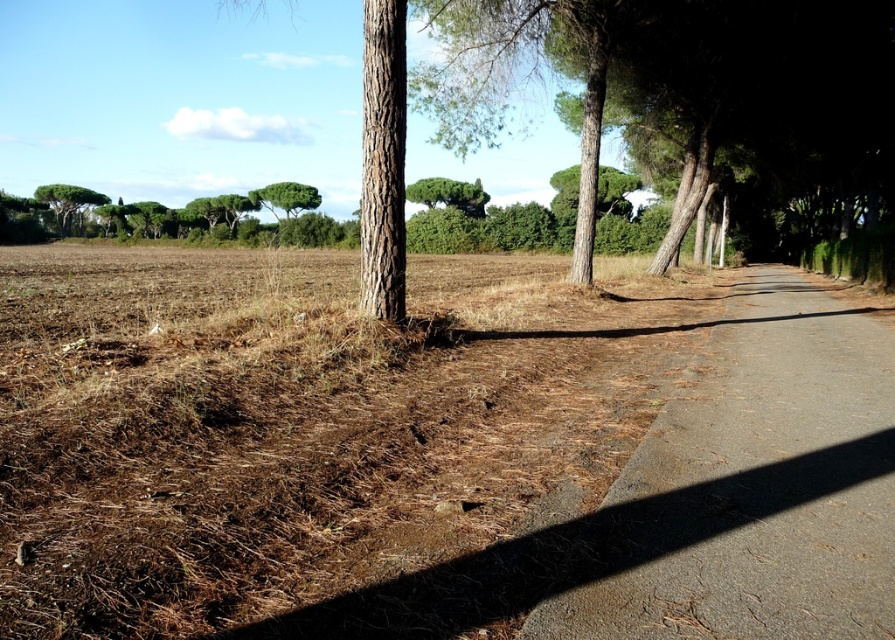
Which of these two, brown dry grass at lower left or green leafy tree at upper left, stands shorter?

brown dry grass at lower left is shorter.

Does point (206, 442) lie in front of point (62, 204)?

Yes, it is.

Which is in front, point (235, 385) or point (54, 216)?

Point (235, 385) is more forward.

Where is `brown dry grass at lower left`? The height and width of the screenshot is (640, 895). brown dry grass at lower left is located at coordinates tap(310, 436).

Can you confirm if brown dry grass at lower left is shorter than green leafy tree at center?

Yes.

Does brown dry grass at lower left appear on the left side of green leafy tree at center?

Indeed, brown dry grass at lower left is positioned on the left side of green leafy tree at center.

The width and height of the screenshot is (895, 640). Describe the element at coordinates (310, 436) in the screenshot. I see `brown dry grass at lower left` at that location.

Locate an element on the screen. The image size is (895, 640). brown dry grass at lower left is located at coordinates (310, 436).

Is brown dry grass at lower left shorter than gray concrete path at center-right?

No.

Who is more distant from viewer, (x=491, y=484) or (x=876, y=532)?

Positioned behind is point (x=491, y=484).

Locate an element on the screen. brown dry grass at lower left is located at coordinates (310, 436).

Locate an element on the screen. The height and width of the screenshot is (640, 895). brown dry grass at lower left is located at coordinates (310, 436).